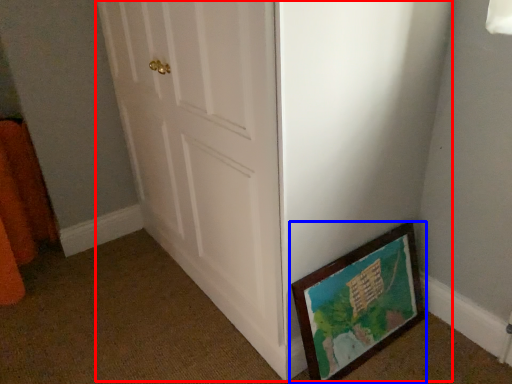
Question: Which of the following is the closest to the observer, door (highlighted by a red box) or picture frame (highlighted by a blue box)?

Choices:
 (A) door
 (B) picture frame

Answer: (A)